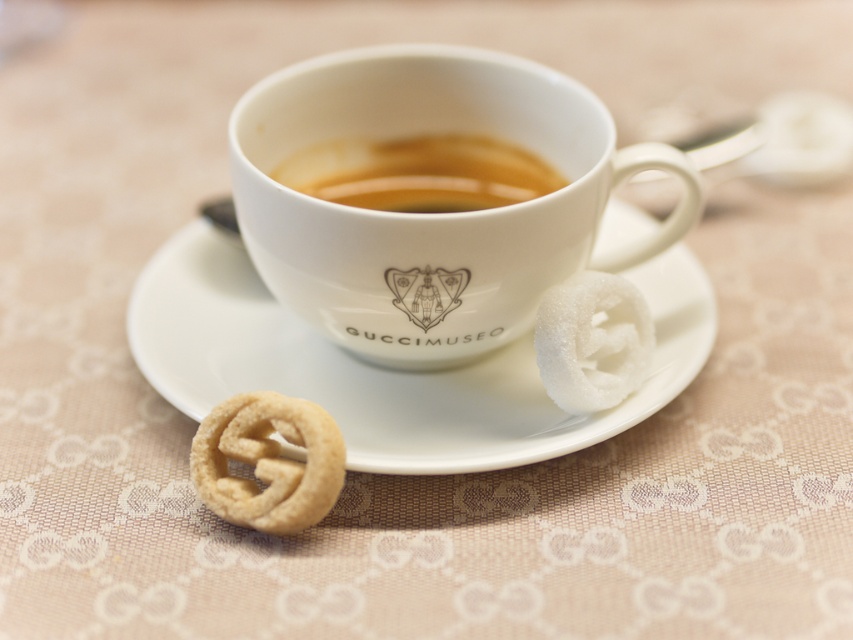
Question: Which of the following is the closest to the observer?

Choices:
 (A) white ceramic saucer at center
 (B) brown liquid at center

Answer: (A)

Question: Among these points, which one is nearest to the camera?

Choices:
 (A) (344, 451)
 (B) (352, 412)
 (C) (373, 186)

Answer: (A)

Question: Does white porcelain cup at center appear on the right side of golden-brown pretzel at lower left?

Choices:
 (A) no
 (B) yes

Answer: (B)

Question: Can you confirm if brown liquid at center is thinner than golden-brown pretzel at lower left?

Choices:
 (A) no
 (B) yes

Answer: (A)

Question: Which of the following is the farthest from the observer?

Choices:
 (A) white porcelain cup at center
 (B) brown liquid at center

Answer: (B)

Question: Does brown liquid at center have a lesser width compared to golden-brown pretzel at lower left?

Choices:
 (A) yes
 (B) no

Answer: (B)